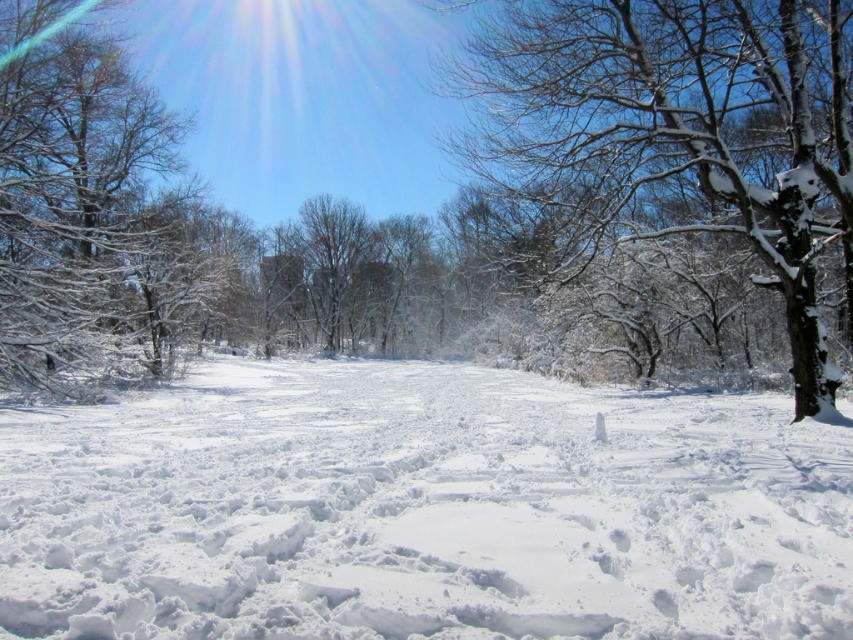
What do you see at coordinates (679, 132) in the screenshot? The height and width of the screenshot is (640, 853). I see `snow-covered tree at right` at bounding box center [679, 132].

Is point (838, 230) farther from viewer compared to point (80, 228)?

No, it is not.

The height and width of the screenshot is (640, 853). Find the location of `snow-covered tree at right`. snow-covered tree at right is located at coordinates click(679, 132).

Which of these two, white fluffy snow at center or snow-covered branches at left, stands taller?

With more height is snow-covered branches at left.

Does white fluffy snow at center have a greater width compared to snow-covered branches at left?

Indeed, white fluffy snow at center has a greater width compared to snow-covered branches at left.

The width and height of the screenshot is (853, 640). In order to click on white fluffy snow at center in this screenshot , I will do `click(421, 509)`.

I want to click on white fluffy snow at center, so click(421, 509).

Is white fluffy snow at center below snow-covered tree at right?

Yes.

Is white fluffy snow at center closer to the viewer compared to snow-covered tree at right?

Yes, it is in front of snow-covered tree at right.

Is point (161, 461) positioned in front of point (763, 253)?

Yes, it is in front of point (763, 253).

Where is `white fluffy snow at center`? white fluffy snow at center is located at coordinates pos(421,509).